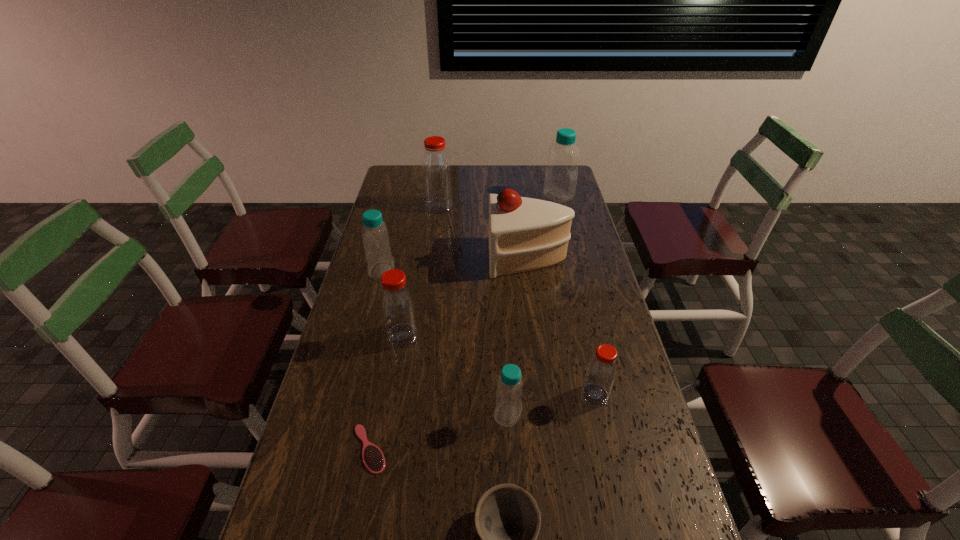
The image size is (960, 540). In order to click on the third bottle from right to left in this screenshot , I will do `click(508, 409)`.

This screenshot has height=540, width=960. In order to click on the nearest blue bottle in this screenshot , I will do `click(508, 409)`.

Where is `the shortest object`? The image size is (960, 540). the shortest object is located at coordinates (373, 458).

Locate an element on the screen. vacant area located 0.230m on the back of the farthest blue bottle is located at coordinates (550, 165).

Where is `vacant area located on the front of the biggest red bottle`? Image resolution: width=960 pixels, height=540 pixels. vacant area located on the front of the biggest red bottle is located at coordinates (432, 258).

The width and height of the screenshot is (960, 540). I want to click on free location located on the left of the cake, so click(444, 257).

Locate an element on the screen. The width and height of the screenshot is (960, 540). vacant space situated on the front of the second nearest blue bottle is located at coordinates (360, 353).

You are a GUI agent. You are given a task and a screenshot of the screen. Output one action in this format:
    pyautogui.click(x=<x>, y=<y>)
    Task: Click on the free space located 0.150m on the front of the fifth nearest object
    This screenshot has height=540, width=960.
    Given the screenshot: What is the action you would take?
    pyautogui.click(x=393, y=391)

Locate an element on the screen. Image resolution: width=960 pixels, height=540 pixels. vacant space situated on the front of the rightmost red bottle is located at coordinates (617, 492).

Image resolution: width=960 pixels, height=540 pixels. What are the coordinates of `blank space located on the left of the nearest blue bottle` in the screenshot? It's located at (344, 414).